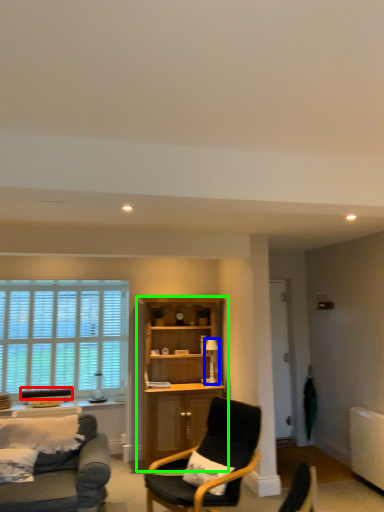
Question: Which object is positioned closest to armchair (highlighted by a red box)? Select from lamp (highlighted by a blue box) and cabinetry (highlighted by a green box).

Choices:
 (A) lamp
 (B) cabinetry

Answer: (B)